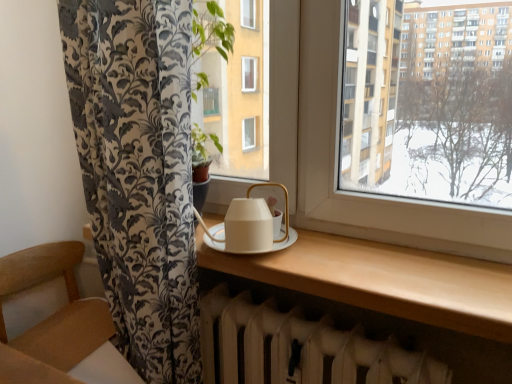
Question: From the image's perspective, would you say white matte radiator at lower center is shown under white matte tea set at center?

Choices:
 (A) yes
 (B) no

Answer: (A)

Question: Does white matte radiator at lower center lie in front of white matte tea set at center?

Choices:
 (A) yes
 (B) no

Answer: (A)

Question: From the image's perspective, would you say white matte radiator at lower center is positioned over white matte tea set at center?

Choices:
 (A) yes
 (B) no

Answer: (B)

Question: Considering the relative positions of white matte radiator at lower center and white matte tea set at center in the image provided, is white matte radiator at lower center to the left of white matte tea set at center from the viewer's perspective?

Choices:
 (A) no
 (B) yes

Answer: (A)

Question: Considering the relative positions of white matte radiator at lower center and white matte tea set at center in the image provided, is white matte radiator at lower center behind white matte tea set at center?

Choices:
 (A) yes
 (B) no

Answer: (B)

Question: Is white matte radiator at lower center oriented towards white matte tea set at center?

Choices:
 (A) no
 (B) yes

Answer: (A)

Question: From a real-world perspective, is wooden armchair at lower left positioned over white matte tea set at center based on gravity?

Choices:
 (A) yes
 (B) no

Answer: (B)

Question: Is wooden armchair at lower left positioned before white matte tea set at center?

Choices:
 (A) yes
 (B) no

Answer: (A)

Question: Could you tell me if wooden armchair at lower left is facing white matte tea set at center?

Choices:
 (A) yes
 (B) no

Answer: (B)

Question: Is wooden armchair at lower left outside of white matte tea set at center?

Choices:
 (A) yes
 (B) no

Answer: (A)

Question: Does wooden armchair at lower left touch white matte tea set at center?

Choices:
 (A) no
 (B) yes

Answer: (A)

Question: Is white matte tea set at center completely or partially inside wooden armchair at lower left?

Choices:
 (A) no
 (B) yes

Answer: (A)

Question: Is white matte tea set at center further to camera compared to matte white table at center?

Choices:
 (A) yes
 (B) no

Answer: (A)